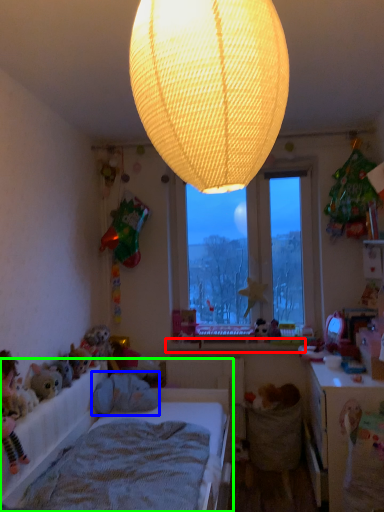
Question: Based on their relative distances, which object is nearer to window sill (highlighted by a red box)? Choose from animal (highlighted by a blue box) and bed (highlighted by a green box).

Choices:
 (A) animal
 (B) bed

Answer: (A)